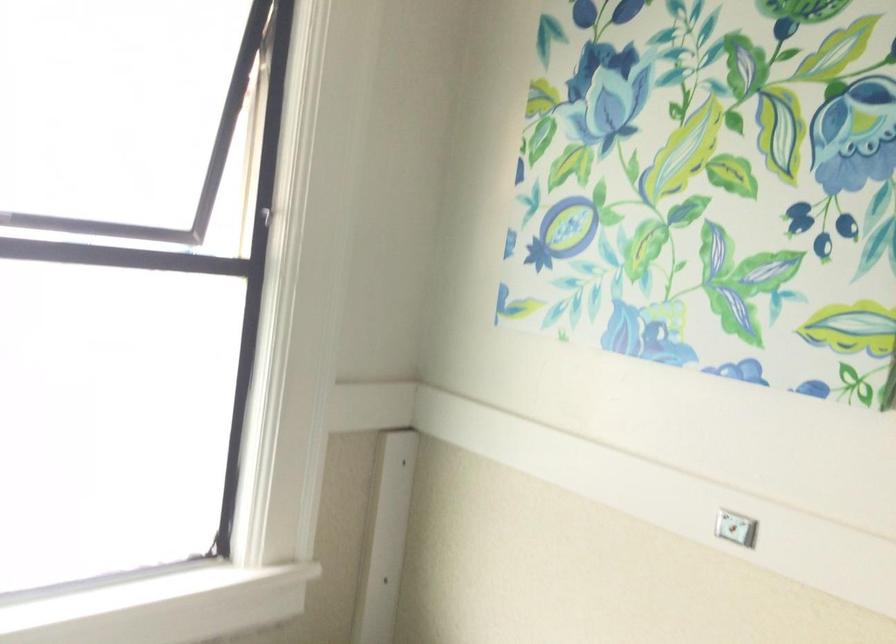
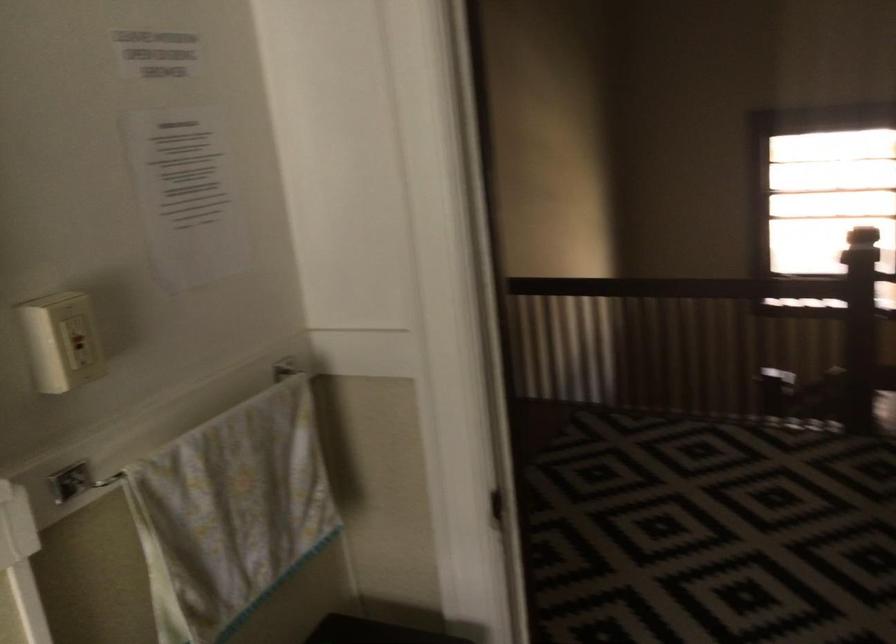
The first image is from the beginning of the video and the second image is from the end. How did the camera likely rotate when shooting the video?

The rotation direction of the camera is right-down.